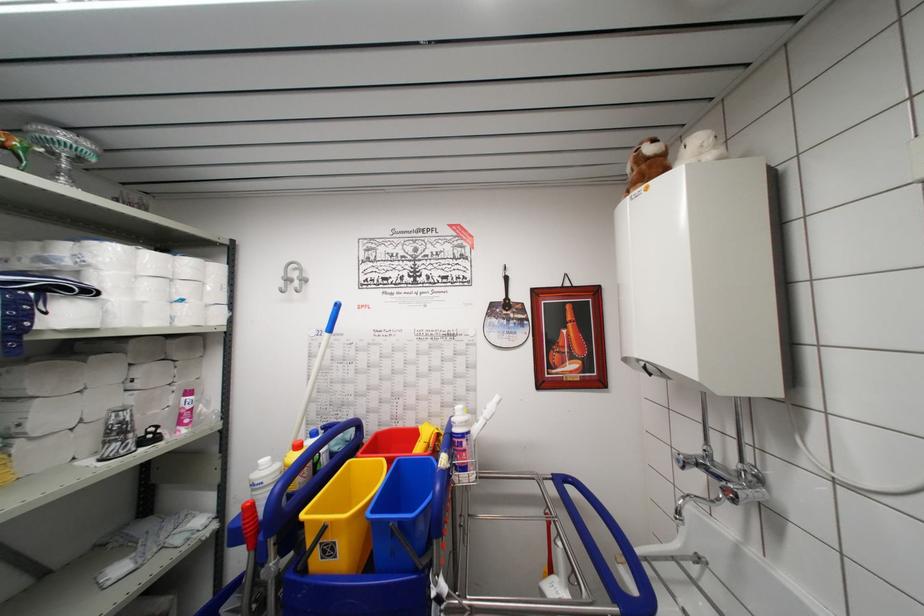
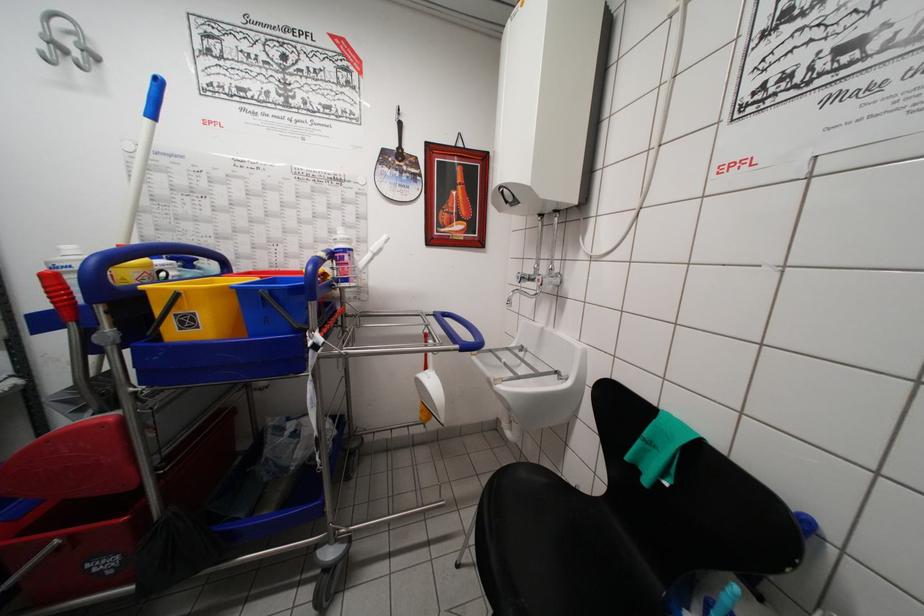
Find the pixel in the second image that matches point (346, 407) in the first image.

(203, 249)